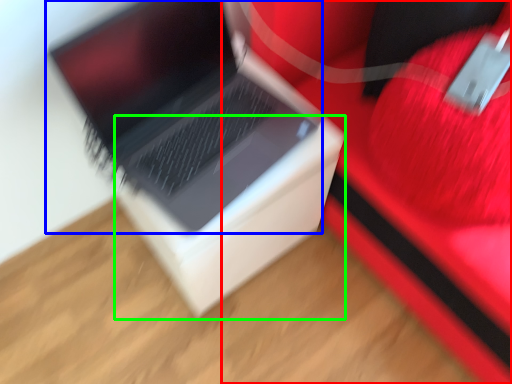
Question: Estimate the real-world distances between objects in this image. Which object is farther from furniture (highlighted by a red box), laptop (highlighted by a blue box) or cardboard box (highlighted by a green box)?

Choices:
 (A) laptop
 (B) cardboard box

Answer: (A)